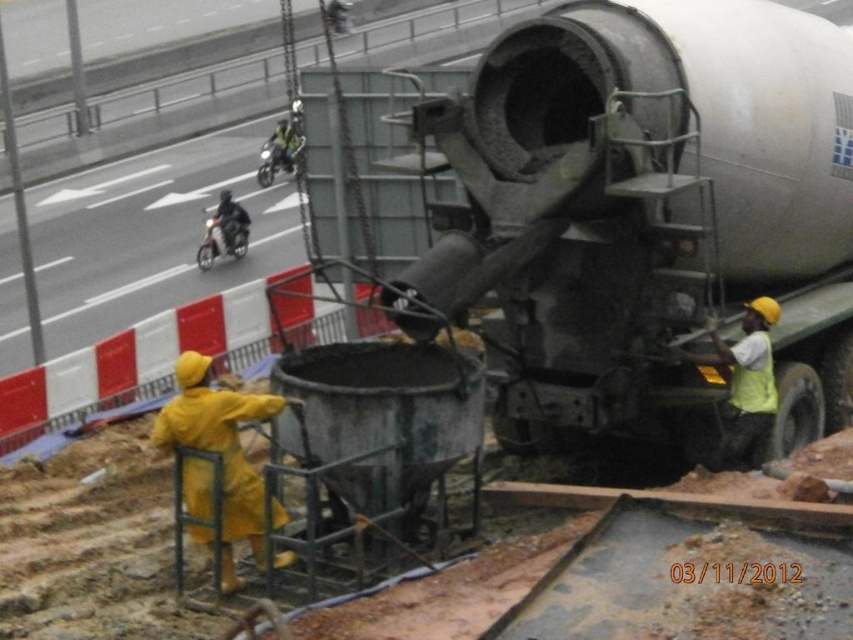
Where is `matte gray tank at right`? matte gray tank at right is located at coordinates (637, 195).

Is matte gray tank at right wider than green matte motorcycle at upper center?

Correct, the width of matte gray tank at right exceeds that of green matte motorcycle at upper center.

This screenshot has width=853, height=640. Find the location of `matte gray tank at right`. matte gray tank at right is located at coordinates (637, 195).

Where is `matte gray tank at right`? matte gray tank at right is located at coordinates (637, 195).

Who is more forward, [650,195] or [207,252]?

Positioned in front is point [650,195].

Can you confirm if matte gray tank at right is wider than shiny black motorcycle at upper left?

Correct, the width of matte gray tank at right exceeds that of shiny black motorcycle at upper left.

Image resolution: width=853 pixels, height=640 pixels. Identify the location of matte gray tank at right. (637, 195).

Can you confirm if yellow rubber raincoat at lower left is wider than green matte motorcycle at upper center?

No, yellow rubber raincoat at lower left is not wider than green matte motorcycle at upper center.

Which is below, yellow rubber raincoat at lower left or green matte motorcycle at upper center?

Positioned lower is yellow rubber raincoat at lower left.

Between point (234, 490) and point (303, 138), which one is positioned in front?

Point (234, 490) is in front.

This screenshot has width=853, height=640. Identify the location of yellow rubber raincoat at lower left. (219, 449).